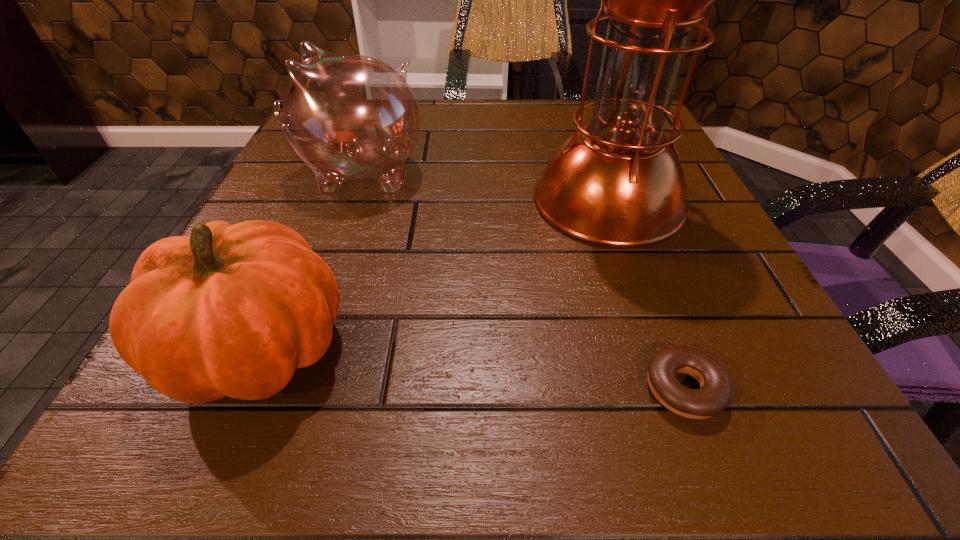
Find the location of a particular element. the tallest object is located at coordinates (618, 182).

Image resolution: width=960 pixels, height=540 pixels. I want to click on piggy bank, so (348, 117).

Image resolution: width=960 pixels, height=540 pixels. Identify the location of pumpkin. (230, 310).

This screenshot has height=540, width=960. I want to click on the shortest object, so click(714, 395).

I want to click on free spot located on the front of the oil lamp, so click(x=636, y=279).

The height and width of the screenshot is (540, 960). I want to click on free location located on the back of the pumpkin, so click(x=347, y=144).

Where is `vacant space located on the back of the doughnut`? The width and height of the screenshot is (960, 540). vacant space located on the back of the doughnut is located at coordinates (607, 180).

Locate an element on the screen. The width and height of the screenshot is (960, 540). object situated at the far edge is located at coordinates (348, 117).

Find the location of `pumpkin that is positioned at the near edge`. pumpkin that is positioned at the near edge is located at coordinates (230, 310).

You are a GUI agent. You are given a task and a screenshot of the screen. Output one action in this format:
    pyautogui.click(x=<x>, y=<y>)
    Task: Click on the doughnut that is at the near edge
    
    Given the screenshot: What is the action you would take?
    pyautogui.click(x=714, y=395)